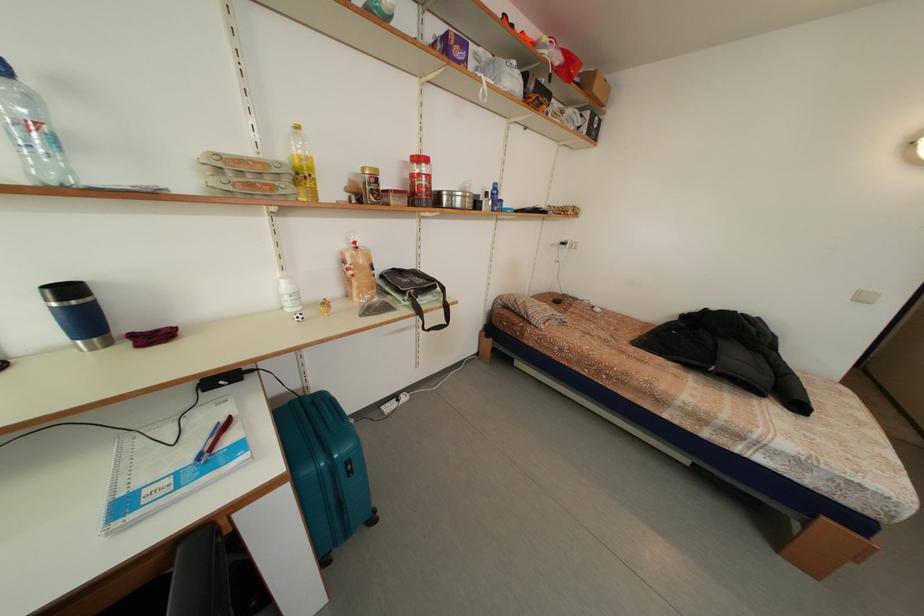
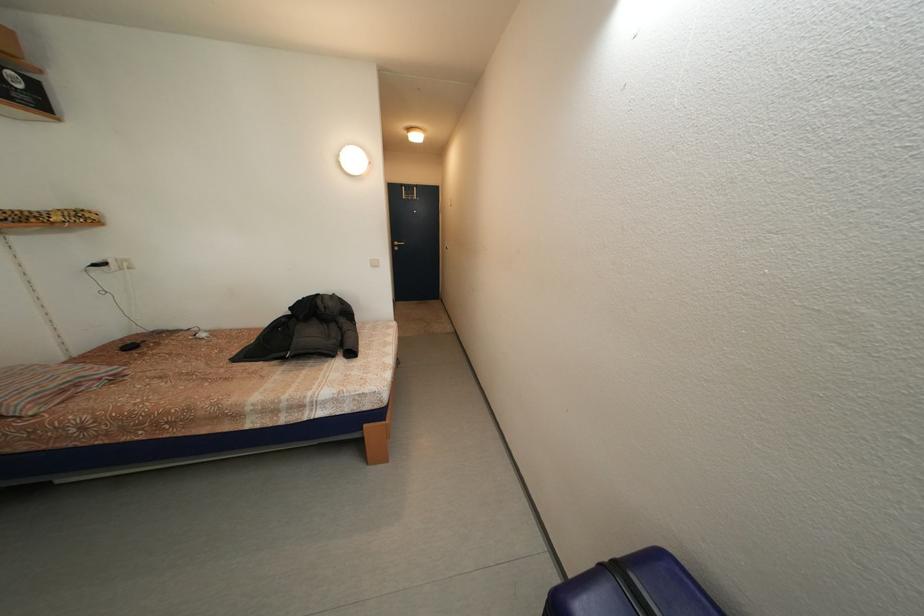
Question: The camera is either moving clockwise (left) or counter-clockwise (right) around the object. The first image is from the beginning of the video and the second image is from the end. Is the camera moving left or right when shooting the video?

Choices:
 (A) Left
 (B) Right

Answer: (A)